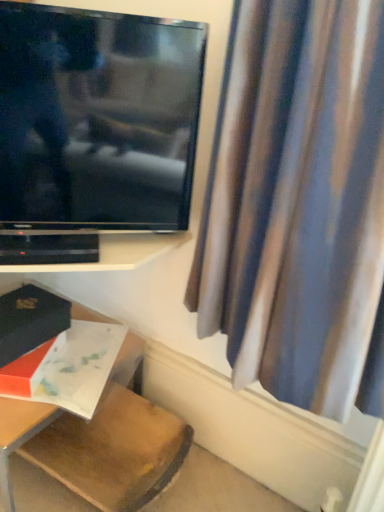
This screenshot has height=512, width=384. What do you see at coordinates (95, 135) in the screenshot?
I see `flat screen tv at upper left` at bounding box center [95, 135].

I want to click on wooden table at lower left, so click(99, 443).

Locate an element on the screen. matte white book at lower left, which is counted as the 2th book, starting from the top is located at coordinates (67, 368).

From the image's perspective, relative to matte black book at lower left, which is counted as the first book, starting from the top, is wooden table at lower left above or below?

wooden table at lower left is situated lower than matte black book at lower left, which is counted as the first book, starting from the top, in the image.

Can you tell me how much wooden table at lower left and matte black book at lower left, which is counted as the first book, starting from the top, differ in facing direction?

wooden table at lower left and matte black book at lower left, which is counted as the first book, starting from the top, are facing 90.8 degrees away from each other.

Is wooden table at lower left aimed at matte black book at lower left, arranged as the second book when ordered from the bottom?

No, wooden table at lower left is not aimed at matte black book at lower left, arranged as the second book when ordered from the bottom.

Considering the relative sizes of wooden table at lower left and matte black book at lower left, which is counted as the first book, starting from the top, in the image provided, is wooden table at lower left smaller than matte black book at lower left, which is counted as the first book, starting from the top,?

Incorrect, wooden table at lower left is not smaller in size than matte black book at lower left, which is counted as the first book, starting from the top.

Who is shorter, wooden table at lower left or matte white book at lower left, which is counted as the 2th book, starting from the top?

With less height is matte white book at lower left, which is counted as the 2th book, starting from the top.

Is wooden table at lower left far from matte white book at lower left, which ranks as the 1th book in bottom-to-top order?

No, wooden table at lower left is not far away from matte white book at lower left, which ranks as the 1th book in bottom-to-top order.

Is wooden table at lower left to the left or to the right of matte white book at lower left, which is counted as the 2th book, starting from the top, in the image?

wooden table at lower left is to the left of matte white book at lower left, which is counted as the 2th book, starting from the top.

Considering the relative sizes of matte white book at lower left, which ranks as the 1th book in bottom-to-top order, and black plastic shelf at lower left in the image provided, is matte white book at lower left, which ranks as the 1th book in bottom-to-top order, wider than black plastic shelf at lower left?

Correct, the width of matte white book at lower left, which ranks as the 1th book in bottom-to-top order, exceeds that of black plastic shelf at lower left.

Is point (31, 367) positioned behind point (180, 245)?

No.

Locate an element on the screen. This screenshot has height=512, width=384. the 2nd book located beneath the black plastic shelf at lower left (from a real-world perspective) is located at coordinates point(67,368).

Is black plastic shelf at lower left beside matte white book at lower left, which ranks as the 1th book in bottom-to-top order?

No, black plastic shelf at lower left is not making contact with matte white book at lower left, which ranks as the 1th book in bottom-to-top order.

Consider the image. Does black plastic shelf at lower left have a greater height compared to matte white book at lower left, which is counted as the 2th book, starting from the top?

Incorrect, the height of black plastic shelf at lower left is not larger of that of matte white book at lower left, which is counted as the 2th book, starting from the top.

Would you say black plastic shelf at lower left is to the left or to the right of matte white book at lower left, which ranks as the 1th book in bottom-to-top order, in the picture?

Based on their positions, black plastic shelf at lower left is located to the right of matte white book at lower left, which ranks as the 1th book in bottom-to-top order.

Can you confirm if black plastic shelf at lower left is thinner than flat screen tv at upper left?

No, black plastic shelf at lower left is not thinner than flat screen tv at upper left.

Which is closer to the camera, (25, 269) or (152, 41)?

Point (25, 269) is positioned farther from the camera compared to point (152, 41).

Is flat screen tv at upper left at the back of black plastic shelf at lower left?

No, flat screen tv at upper left is not at the back of black plastic shelf at lower left.

Is black plastic shelf at lower left positioned before flat screen tv at upper left?

No, black plastic shelf at lower left is further to the viewer.

Would you say black plastic shelf at lower left contains silky blue curtain at right?

No, silky blue curtain at right is not surrounded by black plastic shelf at lower left.

Consider the image. Is silky blue curtain at right at the back of black plastic shelf at lower left?

That's not correct — black plastic shelf at lower left is not looking away from silky blue curtain at right.

Is black plastic shelf at lower left wider than silky blue curtain at right?

Incorrect, the width of black plastic shelf at lower left does not surpass that of silky blue curtain at right.

Consider the image. Considering the relative sizes of flat screen tv at upper left and wooden table at lower left in the image provided, is flat screen tv at upper left shorter than wooden table at lower left?

Incorrect, the height of flat screen tv at upper left does not fall short of that of wooden table at lower left.

Is flat screen tv at upper left turned away from wooden table at lower left?

No, flat screen tv at upper left is not facing the opposite direction of wooden table at lower left.

Where is `furniture on the left of flat screen tv at upper left`? furniture on the left of flat screen tv at upper left is located at coordinates (99, 443).

From the image's perspective, which is above, flat screen tv at upper left or wooden table at lower left?

flat screen tv at upper left.

This screenshot has height=512, width=384. What are the coordinates of `book on the left of wooden table at lower left` in the screenshot? It's located at click(30, 320).

Locate an element on the screen. The image size is (384, 512). furniture below the matte white book at lower left, which is counted as the 2th book, starting from the top (from a real-world perspective) is located at coordinates (99, 443).

Consider the image. Based on their spatial positions, is silky blue curtain at right or black plastic shelf at lower left further from matte white book at lower left, which ranks as the 1th book in bottom-to-top order?

silky blue curtain at right is further to matte white book at lower left, which ranks as the 1th book in bottom-to-top order.

Which object lies nearer to the anchor point silky blue curtain at right, black plastic shelf at lower left or flat screen tv at upper left?

Among the two, flat screen tv at upper left is located nearer to silky blue curtain at right.

Looking at the image, which one is located further to flat screen tv at upper left, silky blue curtain at right or black plastic shelf at lower left?

Among the two, silky blue curtain at right is located further to flat screen tv at upper left.

Which object lies further to the anchor point flat screen tv at upper left, black plastic shelf at lower left or matte black book at lower left, arranged as the second book when ordered from the bottom?

matte black book at lower left, arranged as the second book when ordered from the bottom, lies further to flat screen tv at upper left than the other object.

When comparing their distances from silky blue curtain at right, does flat screen tv at upper left or wooden table at lower left seem further?

wooden table at lower left lies further to silky blue curtain at right than the other object.

Estimate the real-world distances between objects in this image. Which object is further from matte black book at lower left, arranged as the second book when ordered from the bottom, wooden table at lower left or flat screen tv at upper left?

The object further to matte black book at lower left, arranged as the second book when ordered from the bottom, is flat screen tv at upper left.

Based on their spatial positions, is matte black book at lower left, arranged as the second book when ordered from the bottom, or flat screen tv at upper left further from silky blue curtain at right?

matte black book at lower left, arranged as the second book when ordered from the bottom, is further to silky blue curtain at right.

When comparing their distances from matte white book at lower left, which ranks as the 1th book in bottom-to-top order, does silky blue curtain at right or flat screen tv at upper left seem closer?

flat screen tv at upper left lies closer to matte white book at lower left, which ranks as the 1th book in bottom-to-top order, than the other object.

Where is `shelf between silky blue curtain at right and matte white book at lower left, which is counted as the 2th book, starting from the top, in the front-back direction`? shelf between silky blue curtain at right and matte white book at lower left, which is counted as the 2th book, starting from the top, in the front-back direction is located at coordinates (115, 253).

The width and height of the screenshot is (384, 512). I want to click on book that lies between matte black book at lower left, which is counted as the first book, starting from the top, and wooden table at lower left from top to bottom, so click(67, 368).

The image size is (384, 512). Identify the location of television between silky blue curtain at right and matte white book at lower left, which ranks as the 1th book in bottom-to-top order, along the z-axis. point(95,135).

Find the location of a particular element. The height and width of the screenshot is (512, 384). television between matte black book at lower left, arranged as the second book when ordered from the bottom, and silky blue curtain at right is located at coordinates (95, 135).